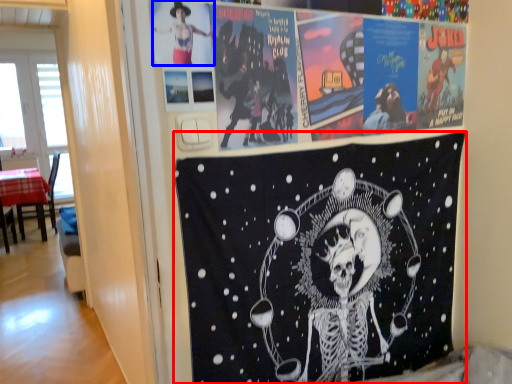
Question: Which object appears closest to the camera in this image, poster (highlighted by a red box) or person (highlighted by a blue box)?

Choices:
 (A) poster
 (B) person

Answer: (B)